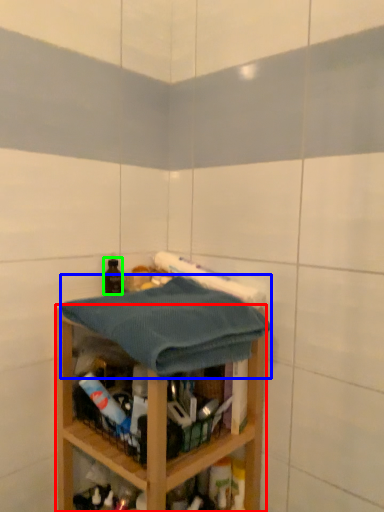
Question: Which is farther away from shelf (highlighted by a red box)? bath towel (highlighted by a blue box) or bottle (highlighted by a green box)?

Choices:
 (A) bath towel
 (B) bottle

Answer: (B)